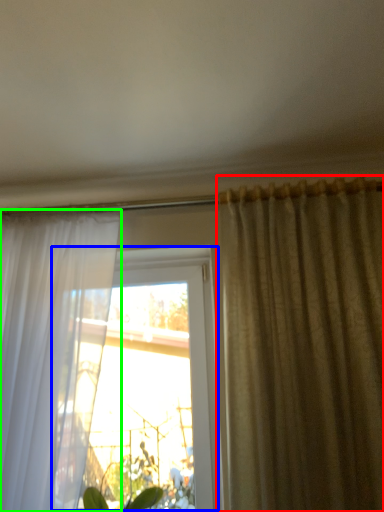
Question: Estimate the real-world distances between objects in this image. Which object is closer to curtain (highlighted by a red box), window (highlighted by a blue box) or curtain (highlighted by a green box)?

Choices:
 (A) window
 (B) curtain

Answer: (A)